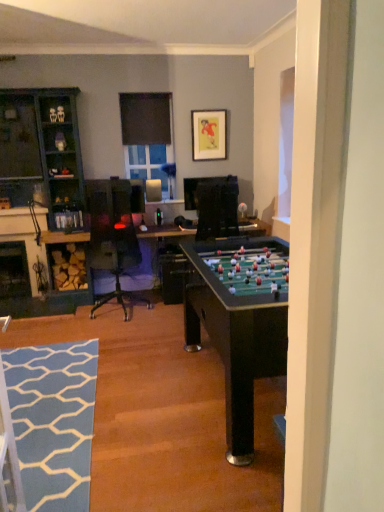
Image resolution: width=384 pixels, height=512 pixels. Identify the location of vacant space to the right of blue textured rug at lower left. (164, 422).